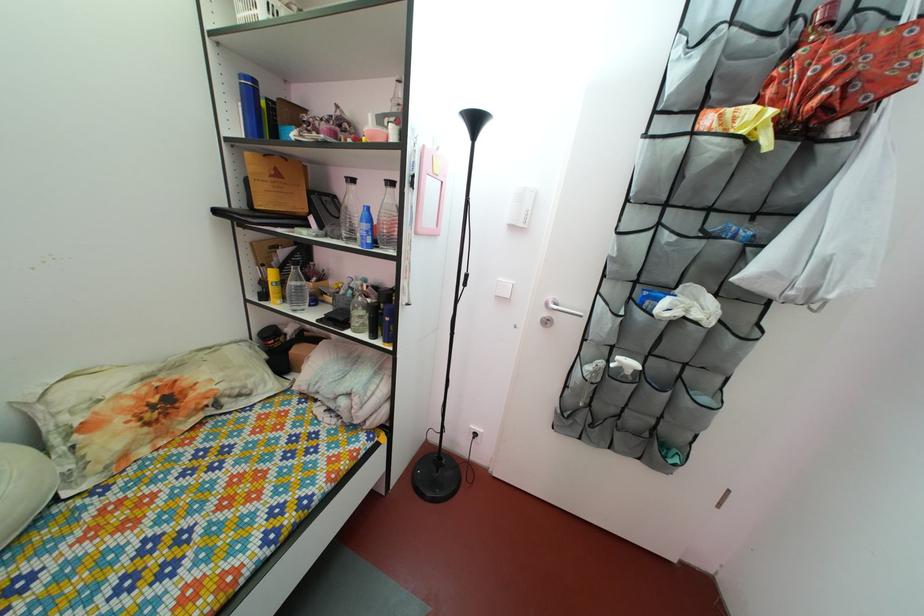
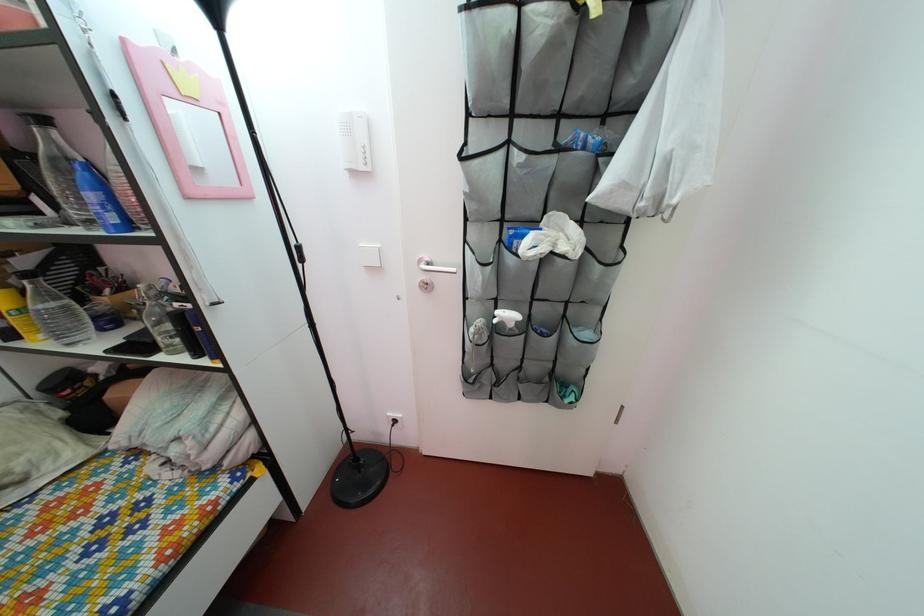
Find the pixel in the second image that matches (x=292, y=262) in the first image.

(32, 270)